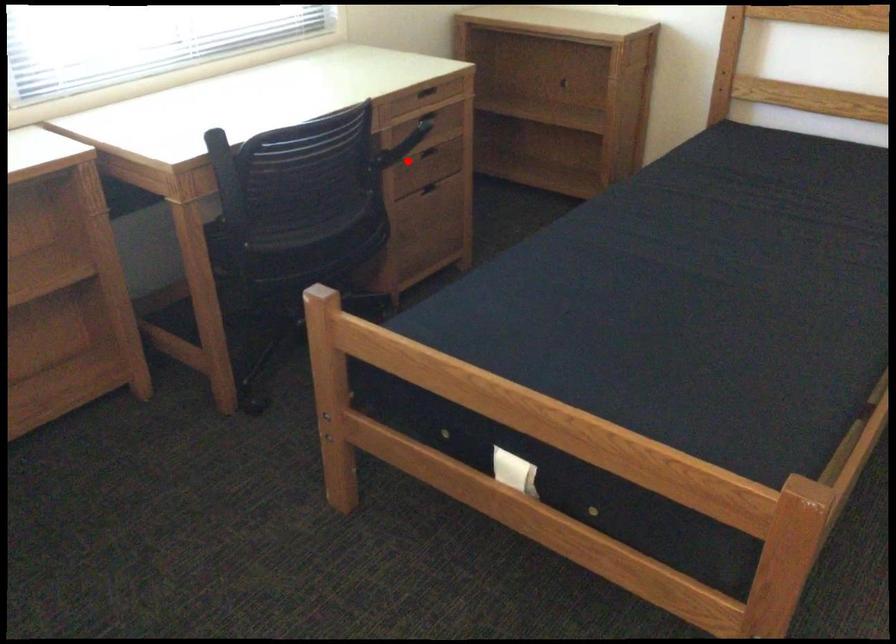
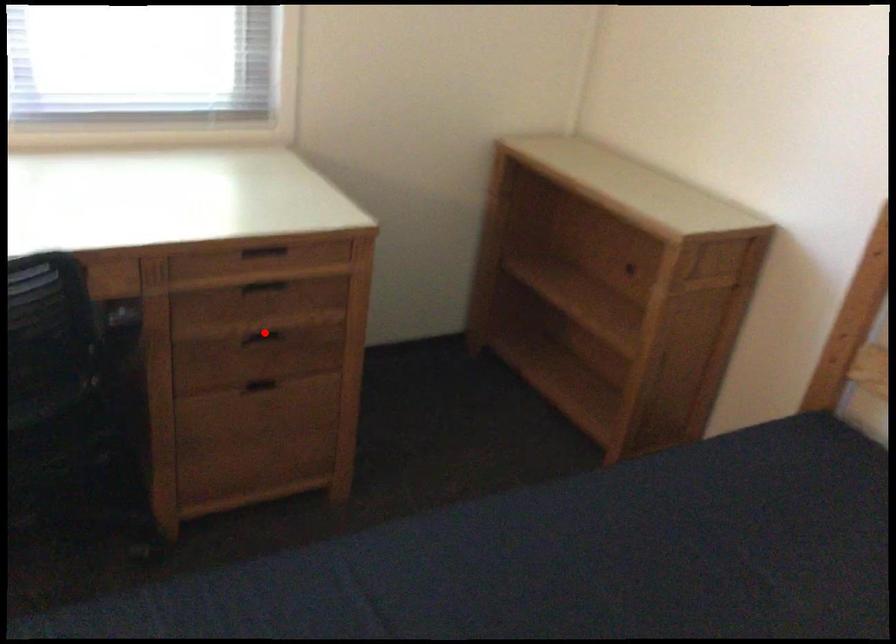
I am providing you with two images of the same scene from different viewpoints. A red point is marked on the first image and another point is marked on the second image. Does the point marked in image1 correspond to the same location as the one in image2?

Yes